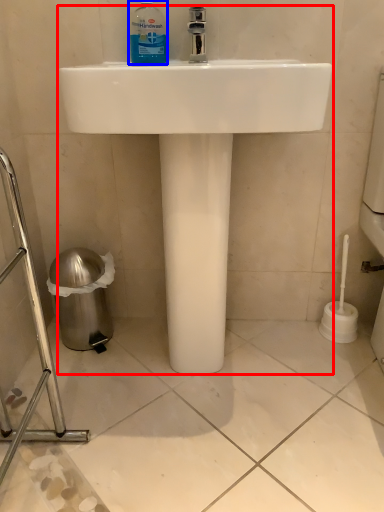
Question: Which point is further to the camera, sink (highlighted by a red box) or cleaning product (highlighted by a blue box)?

Choices:
 (A) sink
 (B) cleaning product

Answer: (B)